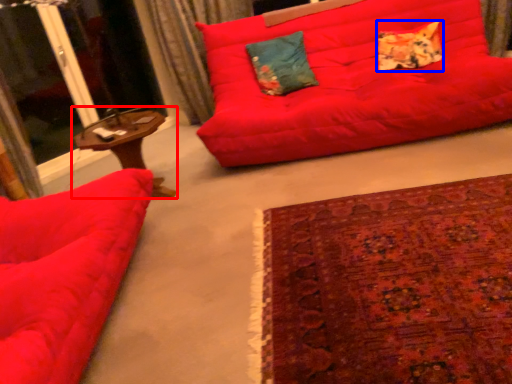
Question: Among these objects, which one is farthest to the camera, table (highlighted by a red box) or pillow (highlighted by a blue box)?

Choices:
 (A) table
 (B) pillow

Answer: (B)